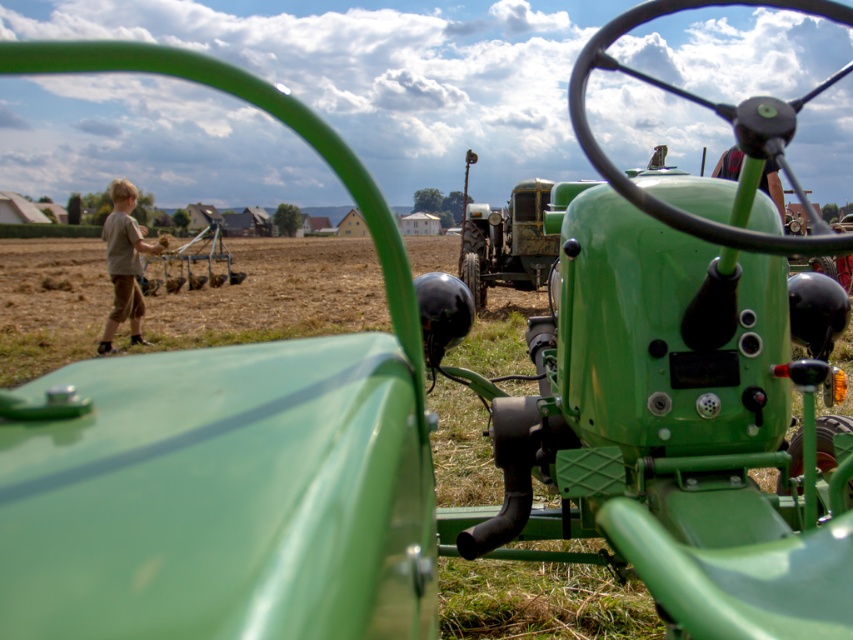
Question: Is green matte tractor at center wider than brown cotton shirt at left?

Choices:
 (A) no
 (B) yes

Answer: (B)

Question: Can you confirm if green matte tractor at center is positioned above brown cotton shirt at left?

Choices:
 (A) no
 (B) yes

Answer: (B)

Question: Does green matte tractor at center have a lesser width compared to brown cotton shirt at left?

Choices:
 (A) yes
 (B) no

Answer: (B)

Question: Which point is closer to the camera taking this photo?

Choices:
 (A) (113, 330)
 (B) (463, 276)

Answer: (A)